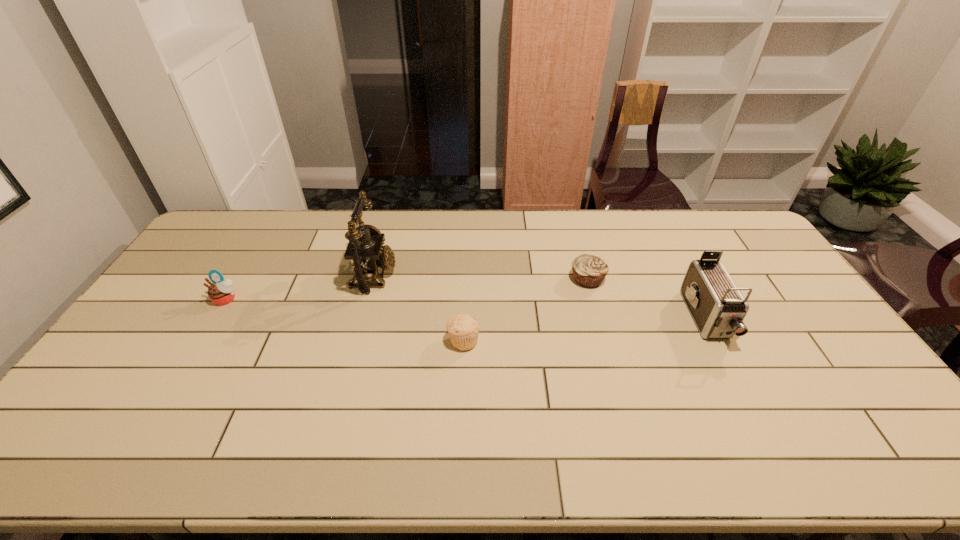
Find the location of a particular element. the fourth object from right to left is located at coordinates (365, 249).

You are a GUI agent. You are given a task and a screenshot of the screen. Output one action in this format:
    pyautogui.click(x=<x>, y=<y>)
    Task: Click on the tallest object
    This screenshot has height=540, width=960.
    Given the screenshot: What is the action you would take?
    pyautogui.click(x=365, y=249)

At what (x,y) coordinates should I click in order to perform the action: click on camcorder. Please return your answer as a coordinate pair (x, y). Looking at the image, I should click on (718, 308).

In order to click on the second tallest object in this screenshot , I will do 718,308.

This screenshot has height=540, width=960. In order to click on the tallest muffin in this screenshot , I will do `click(221, 292)`.

Identify the location of the second nearest muffin. (221, 292).

Where is `the rightmost muffin`? Image resolution: width=960 pixels, height=540 pixels. the rightmost muffin is located at coordinates (589, 271).

Locate an element on the screen. the farthest muffin is located at coordinates (589, 271).

The height and width of the screenshot is (540, 960). What are the coordinates of `the second muffin from right to left` in the screenshot? It's located at (463, 329).

Locate an element on the screen. The height and width of the screenshot is (540, 960). the nearest muffin is located at coordinates click(463, 329).